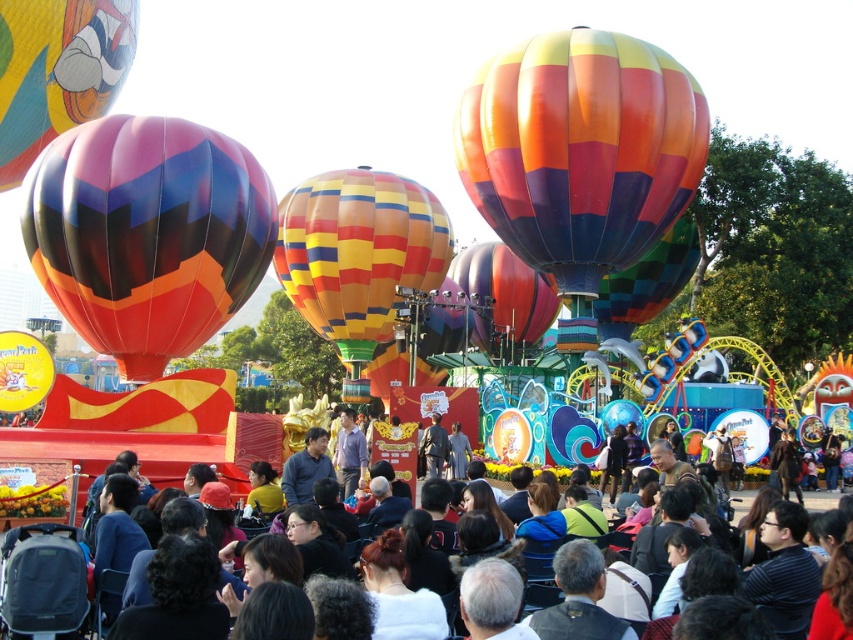
You are a photographer at the festival trying to capture both the rainbow striped balloon at upper center and the multicolored fabric hot air balloon at center in a single shot. Given that your camera has a limited vertical framing capacity, which balloon should you position at the top of the frame to ensure both are fully visible?

The rainbow striped balloon at upper center is taller than the multicolored fabric hot air balloon at center. To ensure both are fully visible in the frame, position the rainbow striped balloon at upper center at the top of the frame since it is taller.

You are standing at the camera position and want to take a photo of the rainbow striped balloon at upper center. The camera can focus on objects up to 100 meters away. Will the balloon be in focus?

The rainbow striped balloon at upper center is 106.95 meters away from camera, which is beyond the camera focus range of 100 meters. Therefore, the balloon will not be in focus.

You are a photographer at the festival. You want to capture a photo that includes both the multicolored striped hot air balloon at center and the multicolored fabric hot air balloon at center. Based on their positions, which balloon should you focus on first to ensure both are in the frame?

The multicolored striped hot air balloon at center is positioned over the multicolored fabric hot air balloon at center, so you should focus on the multicolored fabric hot air balloon at center first to ensure both are in the frame.